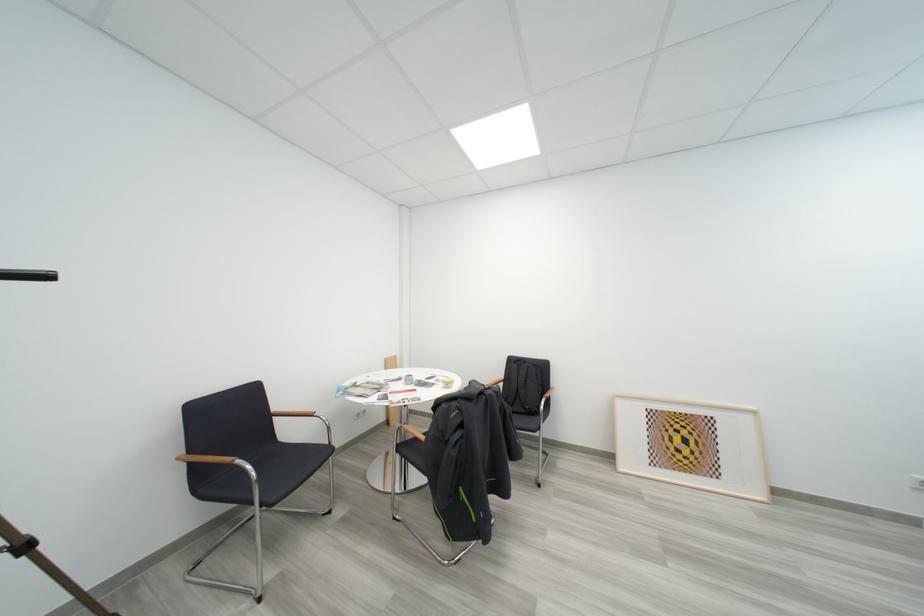
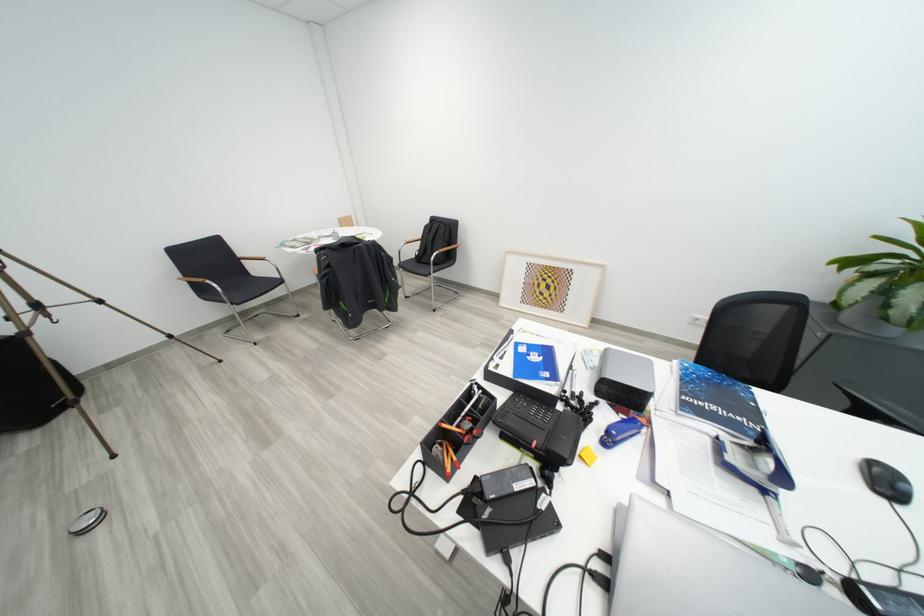
The point at (x=290, y=440) is marked in the first image. Where is the corresponding point in the second image?

(262, 276)